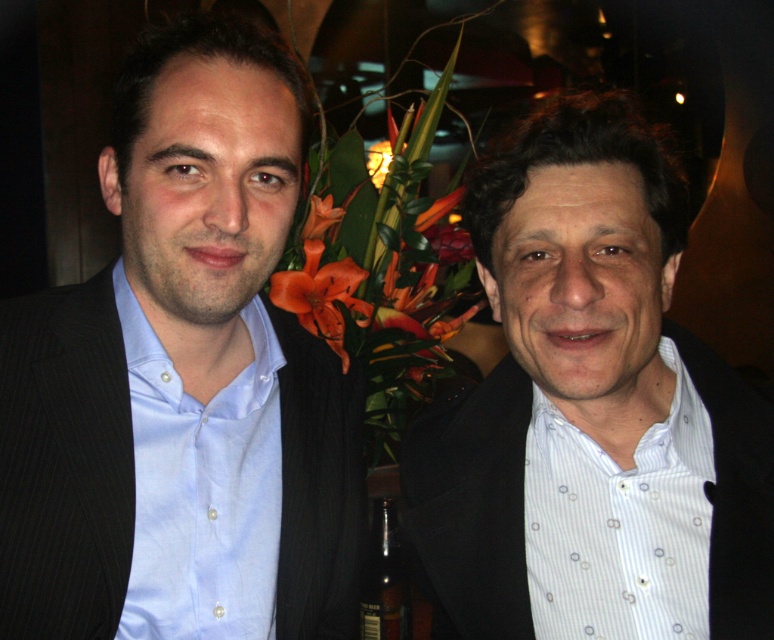
Question: From the image, what is the correct spatial relationship of matte black suit at left in relation to white textured shirt at center?

Choices:
 (A) below
 (B) above

Answer: (B)

Question: Can you confirm if matte black suit at left is bigger than white textured shirt at center?

Choices:
 (A) no
 (B) yes

Answer: (B)

Question: Does matte black suit at left have a larger size compared to white textured shirt at center?

Choices:
 (A) yes
 (B) no

Answer: (A)